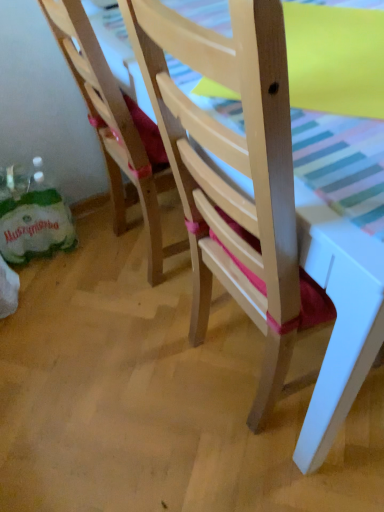
Question: Considering the relative sizes of matte yellow table at upper right and wooden chair at center, marked as the second chair in a left-to-right arrangement, in the image provided, is matte yellow table at upper right wider than wooden chair at center, marked as the second chair in a left-to-right arrangement,?

Choices:
 (A) no
 (B) yes

Answer: (A)

Question: Does matte yellow table at upper right touch wooden chair at center, marked as the second chair in a left-to-right arrangement?

Choices:
 (A) no
 (B) yes

Answer: (A)

Question: Would you say wooden chair at center, marked as the second chair in a left-to-right arrangement, is part of matte yellow table at upper right's contents?

Choices:
 (A) no
 (B) yes

Answer: (A)

Question: Considering the relative positions of matte yellow table at upper right and wooden chair at center, marked as the second chair in a left-to-right arrangement, in the image provided, is matte yellow table at upper right to the left of wooden chair at center, marked as the second chair in a left-to-right arrangement, from the viewer's perspective?

Choices:
 (A) no
 (B) yes

Answer: (A)

Question: Is matte yellow table at upper right bigger than wooden chair at center, which is the first chair from right to left?

Choices:
 (A) yes
 (B) no

Answer: (B)

Question: Considering the relative positions of wooden chair at center, which is the first chair from right to left, and matte yellow table at upper right in the image provided, is wooden chair at center, which is the first chair from right to left, to the left or to the right of matte yellow table at upper right?

Choices:
 (A) right
 (B) left

Answer: (B)

Question: Does point (299, 443) appear closer or farther from the camera than point (380, 86)?

Choices:
 (A) farther
 (B) closer

Answer: (A)

Question: From the image's perspective, relative to matte yellow table at upper right, is wooden chair at center, marked as the second chair in a left-to-right arrangement, above or below?

Choices:
 (A) above
 (B) below

Answer: (B)

Question: Considering the positions of wooden chair at center, marked as the second chair in a left-to-right arrangement, and matte yellow table at upper right in the image, is wooden chair at center, marked as the second chair in a left-to-right arrangement, bigger or smaller than matte yellow table at upper right?

Choices:
 (A) small
 (B) big

Answer: (B)

Question: From the image's perspective, is wooden chair at center, marked as the second chair in a left-to-right arrangement, located above or below wooden chair at lower left, the second chair when ordered from right to left?

Choices:
 (A) above
 (B) below

Answer: (B)

Question: Does point (268, 307) appear closer or farther from the camera than point (122, 211)?

Choices:
 (A) farther
 (B) closer

Answer: (B)

Question: In terms of height, does wooden chair at center, which is the first chair from right to left, look taller or shorter compared to wooden chair at lower left, the second chair when ordered from right to left?

Choices:
 (A) short
 (B) tall

Answer: (B)

Question: In terms of size, does wooden chair at center, which is the first chair from right to left, appear bigger or smaller than wooden chair at lower left, arranged as the first chair when viewed from the left?

Choices:
 (A) small
 (B) big

Answer: (B)

Question: Considering the positions of matte yellow table at upper right and wooden chair at lower left, arranged as the first chair when viewed from the left, in the image, is matte yellow table at upper right bigger or smaller than wooden chair at lower left, arranged as the first chair when viewed from the left,?

Choices:
 (A) small
 (B) big

Answer: (A)

Question: From a real-world perspective, is matte yellow table at upper right physically located above or below wooden chair at lower left, the second chair when ordered from right to left?

Choices:
 (A) above
 (B) below

Answer: (A)